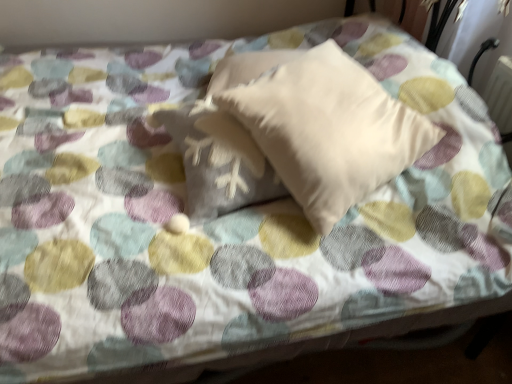
Question: Is beige soft pillow at center, which ranks as the second pillow in left-to-right order, inside or outside of beige soft pillow at center, which is counted as the 1th pillow, starting from the left?

Choices:
 (A) outside
 (B) inside

Answer: (A)

Question: From a real-world perspective, is beige soft pillow at center, which ranks as the second pillow in left-to-right order, positioned above or below beige soft pillow at center, acting as the 2th pillow starting from the right?

Choices:
 (A) above
 (B) below

Answer: (A)

Question: Is beige soft pillow at center, which ranks as the 1th pillow in right-to-left order, taller or shorter than beige soft pillow at center, which is counted as the 1th pillow, starting from the left?

Choices:
 (A) tall
 (B) short

Answer: (A)

Question: Is point pyautogui.click(x=199, y=165) closer or farther from the camera than point pyautogui.click(x=333, y=91)?

Choices:
 (A) farther
 (B) closer

Answer: (A)

Question: Considering the positions of beige soft pillow at center, which is counted as the 1th pillow, starting from the left, and beige soft pillow at center, which ranks as the second pillow in left-to-right order, in the image, is beige soft pillow at center, which is counted as the 1th pillow, starting from the left, wider or thinner than beige soft pillow at center, which ranks as the second pillow in left-to-right order,?

Choices:
 (A) thin
 (B) wide

Answer: (A)

Question: Based on their sizes in the image, would you say beige soft pillow at center, acting as the 2th pillow starting from the right, is bigger or smaller than beige soft pillow at center, which ranks as the 1th pillow in right-to-left order?

Choices:
 (A) small
 (B) big

Answer: (A)

Question: Relative to beige soft pillow at center, which ranks as the 1th pillow in right-to-left order, is beige soft pillow at center, acting as the 2th pillow starting from the right, in front or behind?

Choices:
 (A) behind
 (B) front

Answer: (A)